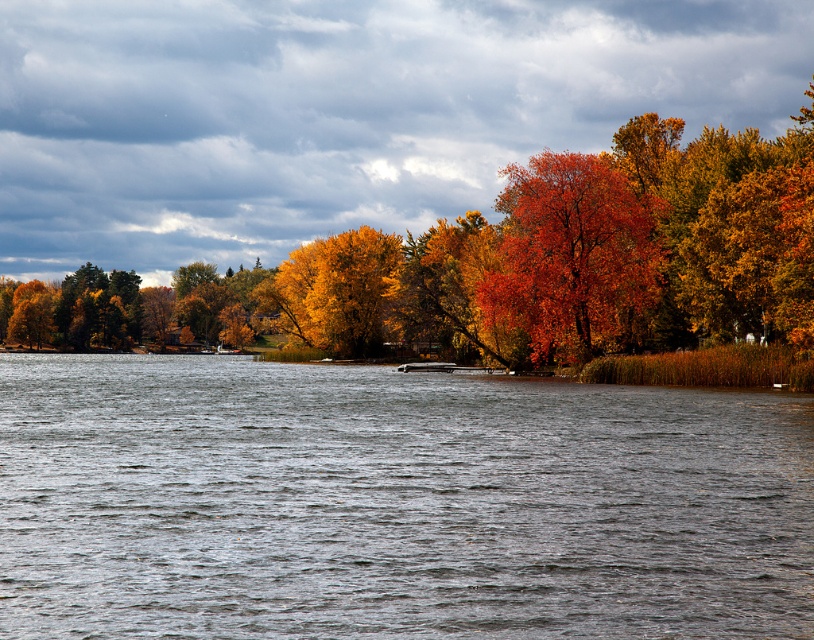
Between gray water at center and vivid orange leaves at center, which one has less height?

gray water at center

Who is lower down, gray water at center or vivid orange leaves at center?

gray water at center

I want to click on gray water at center, so click(392, 502).

This screenshot has height=640, width=814. I want to click on gray water at center, so click(392, 502).